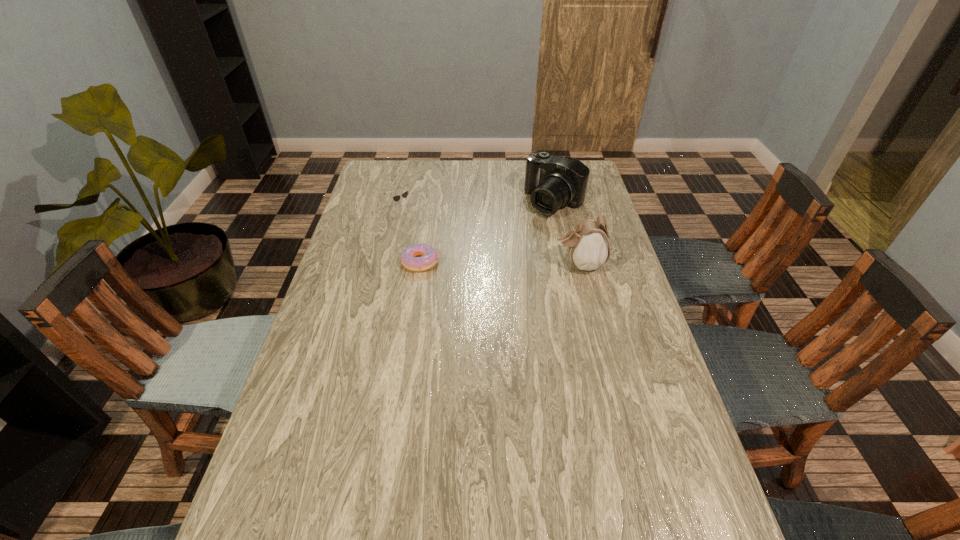
Where is `vacant space at the left edge of the desktop`? The image size is (960, 540). vacant space at the left edge of the desktop is located at coordinates (320, 338).

Identify the location of blank space at the right edge of the desktop. 607,213.

Where is `free spot at the far left corner of the desktop`? This screenshot has width=960, height=540. free spot at the far left corner of the desktop is located at coordinates (409, 172).

This screenshot has width=960, height=540. Find the location of `free space at the far right corner of the desktop`. free space at the far right corner of the desktop is located at coordinates (590, 173).

The image size is (960, 540). What are the coordinates of `vacant space at the near right corner of the desktop` in the screenshot? It's located at (649, 480).

You are a GUI agent. You are given a task and a screenshot of the screen. Output one action in this format:
    pyautogui.click(x=<x>, y=<y>)
    Task: Click on the free spot between the third tallest object and the shortest object
    
    Given the screenshot: What is the action you would take?
    pyautogui.click(x=412, y=235)

The width and height of the screenshot is (960, 540). I want to click on blank region between the pouch and the shortest object, so click(500, 263).

The height and width of the screenshot is (540, 960). In order to click on unoccupied area between the camera and the third tallest object in this screenshot , I will do `click(478, 205)`.

The width and height of the screenshot is (960, 540). I want to click on free area in between the pouch and the sunglasses, so click(x=492, y=236).

Where is `free space between the shortest object and the second shortest object`? free space between the shortest object and the second shortest object is located at coordinates (412, 235).